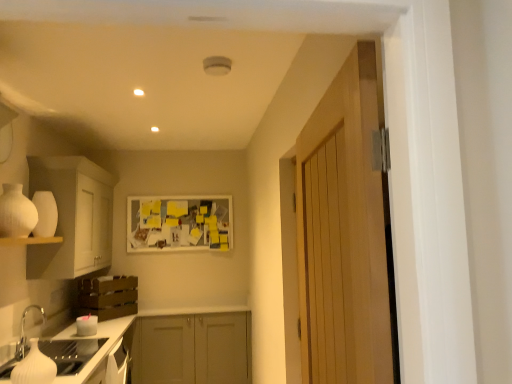
Find the location of a particular element. vacant space in yellow paper at center (from a real-world perspective) is located at coordinates (173, 308).